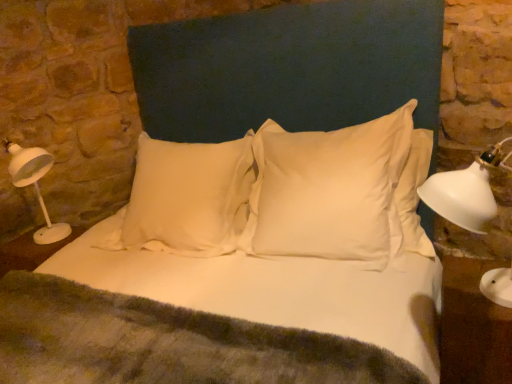
Question: Is white plastic table lamp at left facing away from white smooth pillow at center, the second pillow viewed from the left?

Choices:
 (A) yes
 (B) no

Answer: (B)

Question: From a real-world perspective, is white plastic table lamp at left over white smooth pillow at center, the second pillow viewed from the left?

Choices:
 (A) no
 (B) yes

Answer: (B)

Question: From the image's perspective, is white plastic table lamp at left beneath white smooth pillow at center, the second pillow viewed from the left?

Choices:
 (A) yes
 (B) no

Answer: (A)

Question: Is white plastic table lamp at left not close to white smooth pillow at center, placed as the first pillow when sorted from right to left?

Choices:
 (A) yes
 (B) no

Answer: (A)

Question: Does white plastic table lamp at left have a smaller size compared to white smooth pillow at center, placed as the first pillow when sorted from right to left?

Choices:
 (A) yes
 (B) no

Answer: (A)

Question: Is white smooth pillow at center, placed as the first pillow when sorted from right to left, inside or outside of white satin pillow at center, marked as the second pillow in a right-to-left arrangement?

Choices:
 (A) outside
 (B) inside

Answer: (A)

Question: From a real-world perspective, is white smooth pillow at center, placed as the first pillow when sorted from right to left, physically located above or below white satin pillow at center, marked as the second pillow in a right-to-left arrangement?

Choices:
 (A) below
 (B) above

Answer: (B)

Question: Relative to white satin pillow at center, marked as the second pillow in a right-to-left arrangement, is white smooth pillow at center, placed as the first pillow when sorted from right to left, in front or behind?

Choices:
 (A) behind
 (B) front

Answer: (B)

Question: From the image's perspective, relative to white satin pillow at center, marked as the second pillow in a right-to-left arrangement, is white smooth pillow at center, placed as the first pillow when sorted from right to left, above or below?

Choices:
 (A) above
 (B) below

Answer: (A)

Question: From a real-world perspective, is white glossy table at lower right above or below white fabric headboard at center?

Choices:
 (A) below
 (B) above

Answer: (A)

Question: Would you say white glossy table at lower right is to the left or to the right of white fabric headboard at center in the picture?

Choices:
 (A) left
 (B) right

Answer: (B)

Question: From the image's perspective, is white glossy table at lower right located above or below white fabric headboard at center?

Choices:
 (A) below
 (B) above

Answer: (A)

Question: From their relative heights in the image, would you say white glossy table at lower right is taller or shorter than white fabric headboard at center?

Choices:
 (A) tall
 (B) short

Answer: (B)

Question: Is white satin pillow at center, positioned as the first pillow in left-to-right order, to the left or to the right of white glossy table at lower right in the image?

Choices:
 (A) right
 (B) left

Answer: (B)

Question: Relative to white glossy table at lower right, is white satin pillow at center, marked as the second pillow in a right-to-left arrangement, in front or behind?

Choices:
 (A) behind
 (B) front

Answer: (A)